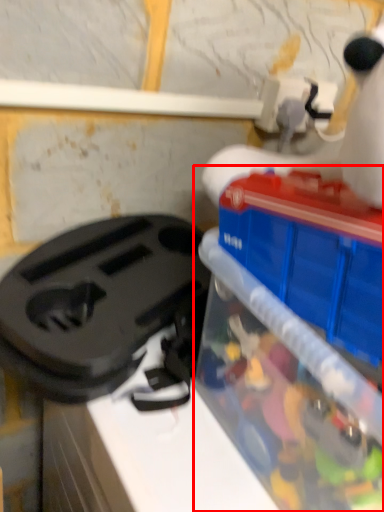
Question: From the image, what is the correct spatial relationship of toy (annotated by the red box) in relation to appliance?

Choices:
 (A) left
 (B) right

Answer: (B)